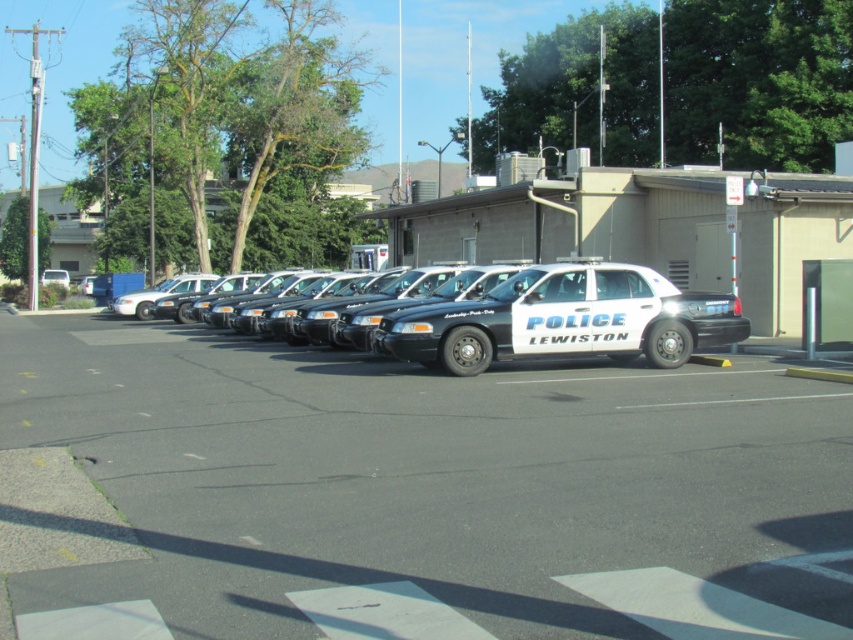
You are a delivery driver who needs to park your vehicle in the lot shown. The parking spot you want is directly to the north of the white glossy police car at center. Is this parking spot available?

The question cannot be answered with the provided information. The scene description mentions police vehicles parked in a lot but does not specify the availability of parking spots north of the white glossy police car at center.

You are a delivery driver who needs to unload a package onto the sidewalk behind the police cars. Which police car should you move first to access the sidewalk? Please choose between the white glossy police car at center and the black glossy police car at center.

The white glossy police car at center is positioned under the black glossy police car at center, so you should move the white glossy police car at center first to access the sidewalk.

You are standing in the parking lot and want to walk towards the building. Which point, point (593,464) or point (595,275), is closer to you as you start walking?

Point (593,464) is closer to the viewer than point (595,275), so it would be the closer point as you start walking.